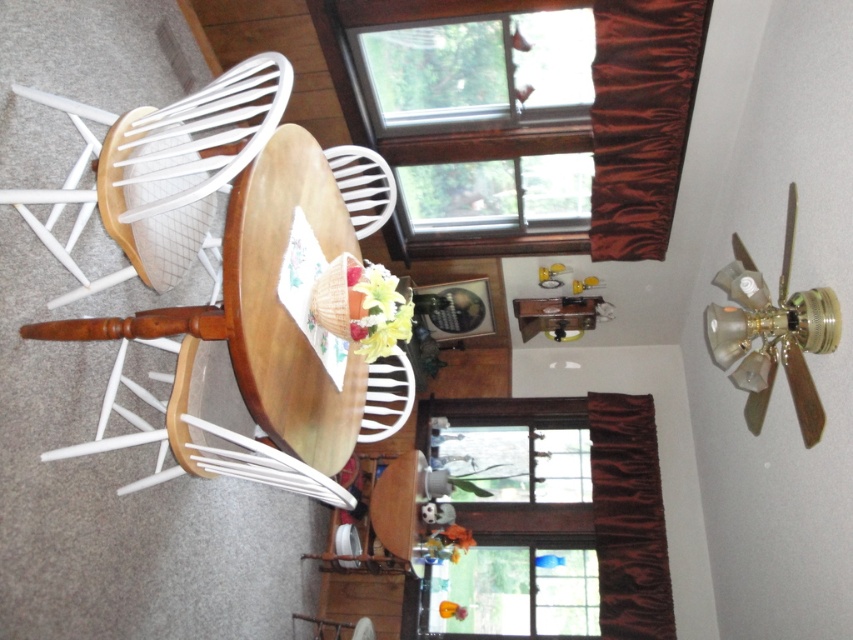
Question: Where is brown wood window at upper center located in relation to clear glass window at center in the image?

Choices:
 (A) right
 (B) left

Answer: (B)

Question: Which of the following is the closest to the observer?

Choices:
 (A) (199, 97)
 (B) (569, 93)
 (C) (247, 352)
 (D) (750, 387)

Answer: (C)

Question: Does clear glass window at center come behind white painted wood chair at left?

Choices:
 (A) yes
 (B) no

Answer: (A)

Question: Which point is farther from the camera taking this photo?

Choices:
 (A) (106, 198)
 (B) (389, 33)
 (C) (299, 140)
 (D) (479, 609)

Answer: (D)

Question: Observing the image, what is the correct spatial positioning of brown wood window at upper center in reference to gold metallic fan at upper right?

Choices:
 (A) left
 (B) right

Answer: (A)

Question: Among these objects, which one is nearest to the camera?

Choices:
 (A) white painted wood chair at left
 (B) brown wood window at upper center
 (C) wooden chair at center

Answer: (A)